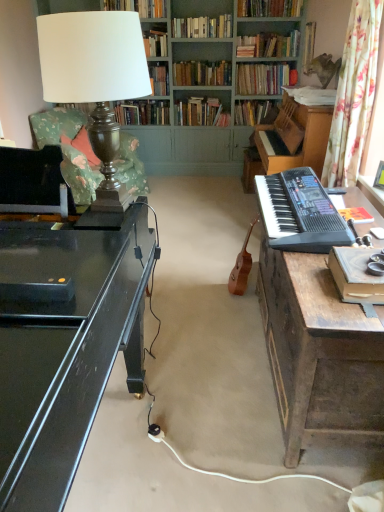
Identify the location of free space above wooden book at right, which is the twelfth book from back to front (from a real-world perspective). Image resolution: width=384 pixels, height=512 pixels. (353, 264).